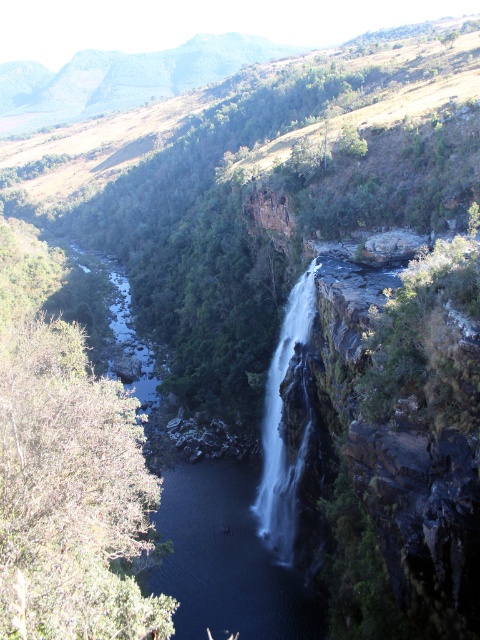
Who is lower down, clear water at center or white smooth waterfall at center?

Positioned lower is white smooth waterfall at center.

Image resolution: width=480 pixels, height=640 pixels. What do you see at coordinates (225, 557) in the screenshot?
I see `clear water at center` at bounding box center [225, 557].

The width and height of the screenshot is (480, 640). I want to click on clear water at center, so click(225, 557).